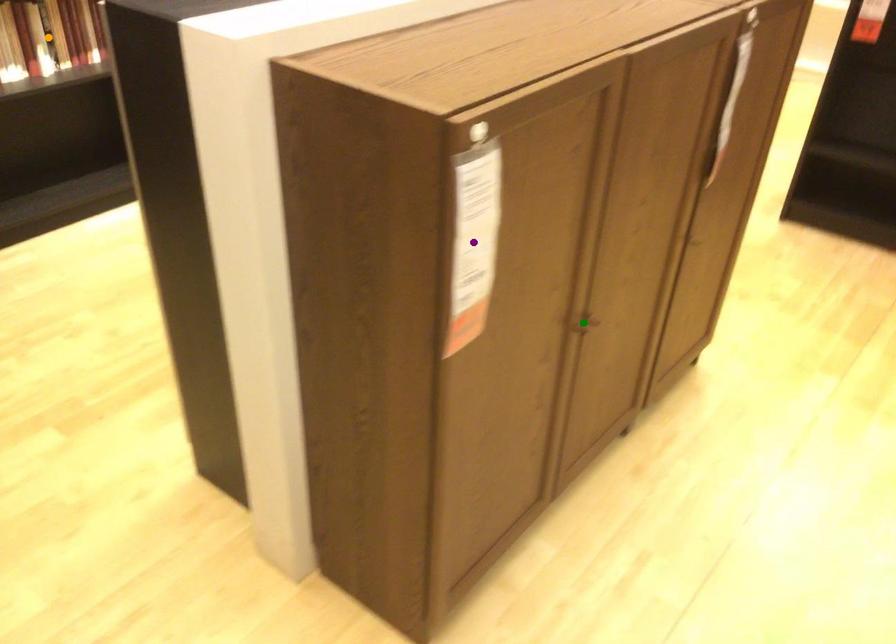
Order these from nearest to farthest:
orange point, purple point, green point

orange point, green point, purple point